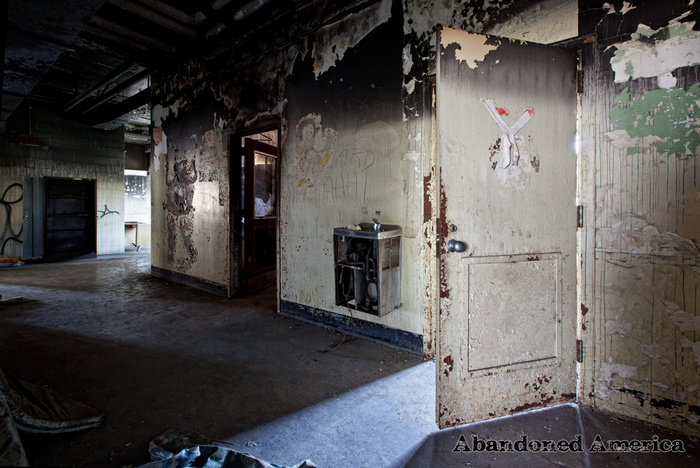
What are the coordinates of `door` in the screenshot? It's located at point(265,236).